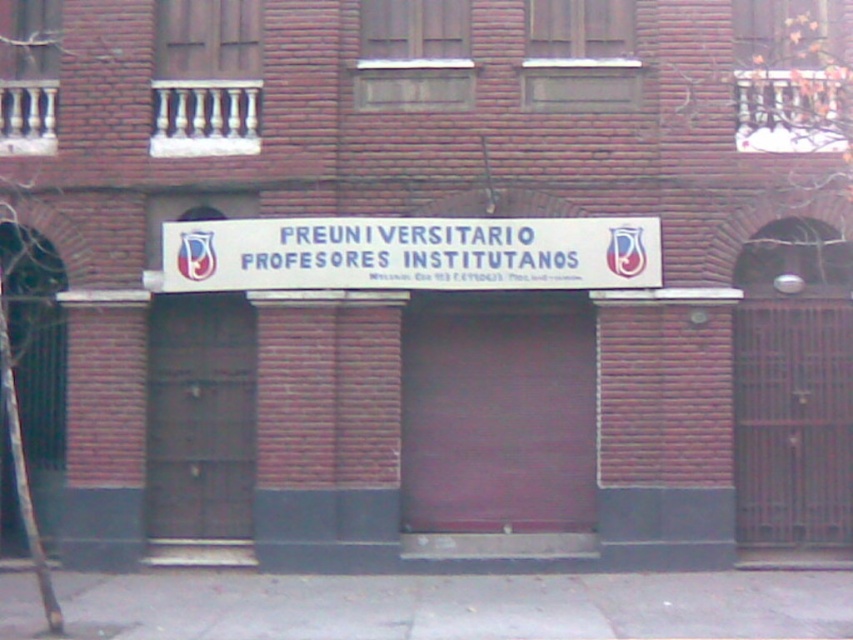
Which of these two, gray concrete pavement at lower center or white plastic sign at center, stands shorter?

gray concrete pavement at lower center

I want to click on gray concrete pavement at lower center, so click(x=461, y=605).

At what (x,y) coordinates should I click in order to perform the action: click on gray concrete pavement at lower center. Please return your answer as a coordinate pair (x, y). The height and width of the screenshot is (640, 853). Looking at the image, I should click on (461, 605).

Find the location of `gray concrete pavement at lower center`. gray concrete pavement at lower center is located at coordinates (461, 605).